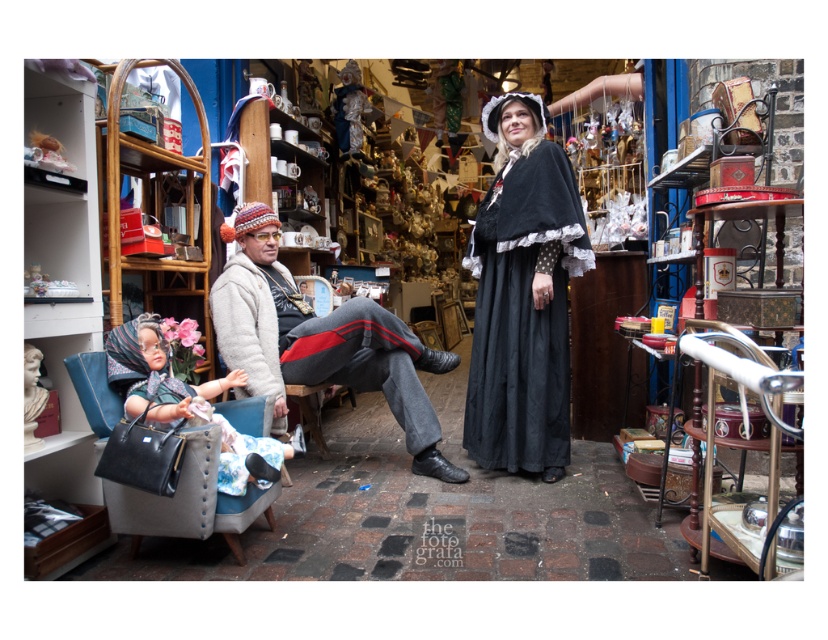
Question: Which point is farther to the camera?

Choices:
 (A) (140, 323)
 (B) (533, 289)

Answer: (B)

Question: Is leather armchair at left positioned in front of matte black purse at lower left?

Choices:
 (A) no
 (B) yes

Answer: (B)

Question: From the image, what is the correct spatial relationship of black satin dress at center in relation to leather armchair at left?

Choices:
 (A) above
 (B) below

Answer: (A)

Question: Which of these objects is positioned farthest from the black satin dress at center?

Choices:
 (A) matte black purse at lower left
 (B) leather armchair at left

Answer: (B)

Question: Which object is positioned farthest from the leather armchair at left?

Choices:
 (A) black satin dress at center
 (B) matte black purse at lower left
 (C) knitted woolen hat at center

Answer: (A)

Question: Is leather armchair at left to the right of matte black purse at lower left from the viewer's perspective?

Choices:
 (A) yes
 (B) no

Answer: (B)